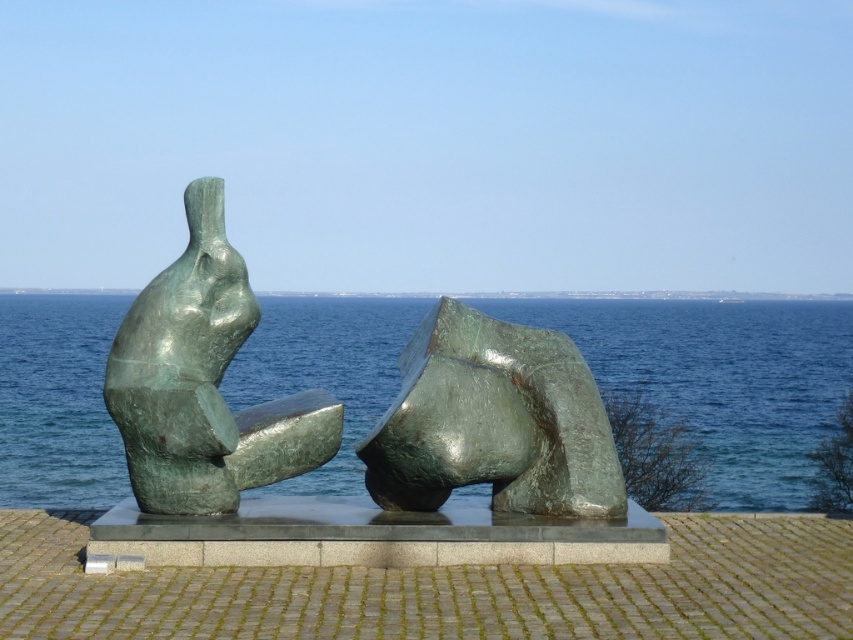
Who is lower down, green polished stone abstract form at center or green patina sculpture at left?

green polished stone abstract form at center

Does green polished stone abstract form at center appear on the right side of green patina sculpture at left?

Indeed, green polished stone abstract form at center is positioned on the right side of green patina sculpture at left.

I want to click on green polished stone abstract form at center, so click(492, 420).

Is green metallic water at center positioned before green patina sculpture at left?

No, green metallic water at center is behind green patina sculpture at left.

Who is positioned more to the right, green metallic water at center or green patina sculpture at left?

Positioned to the right is green metallic water at center.

Between point (755, 497) and point (154, 438), which one is positioned in front?

Positioned in front is point (154, 438).

Identify the location of green metallic water at center. This screenshot has height=640, width=853. (718, 378).

Which of these two, green metallic water at center or green polished stone abstract form at center, stands shorter?

green polished stone abstract form at center

From the picture: Does green metallic water at center appear over green polished stone abstract form at center?

No.

Where is `green metallic water at center`? The image size is (853, 640). green metallic water at center is located at coordinates (718, 378).